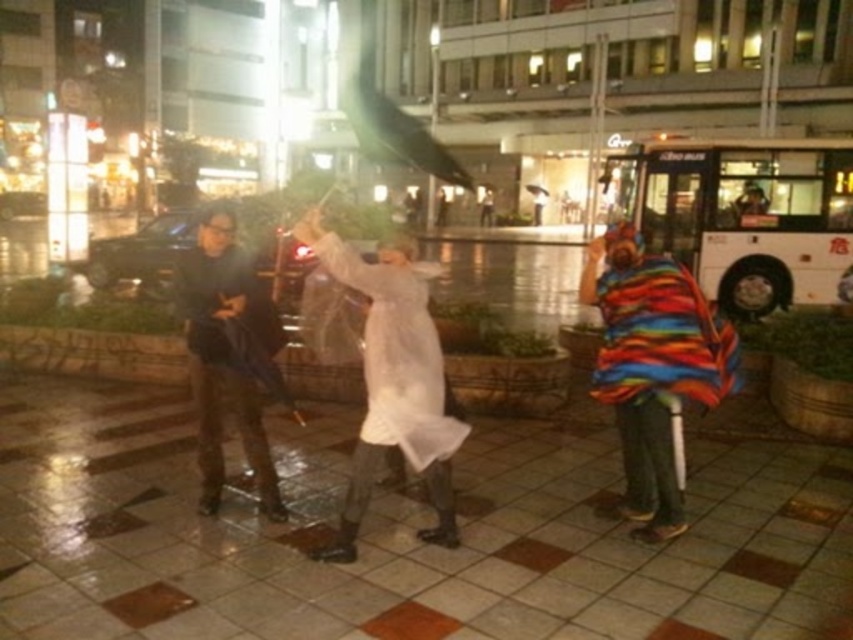
Question: Which point is closer to the camera taking this photo?

Choices:
 (A) (370, 307)
 (B) (247, 317)

Answer: (A)

Question: Does white translucent coat at center lie behind dark blue fabric jacket at center?

Choices:
 (A) no
 (B) yes

Answer: (A)

Question: Is white translucent coat at center to the right of dark blue fabric jacket at center from the viewer's perspective?

Choices:
 (A) no
 (B) yes

Answer: (B)

Question: Which point appears farthest from the camera in this image?

Choices:
 (A) (322, 556)
 (B) (248, 266)

Answer: (B)

Question: In this image, where is white translucent coat at center located relative to dark blue fabric jacket at center?

Choices:
 (A) left
 (B) right

Answer: (B)